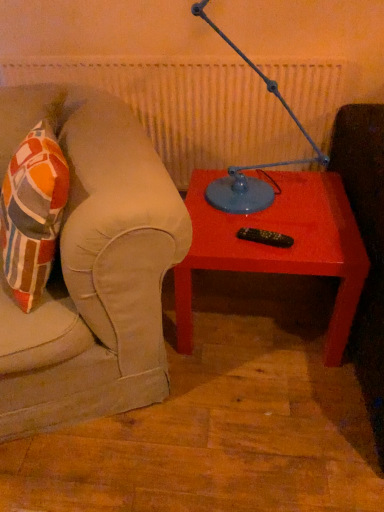
Describe the element at coordinates (253, 165) in the screenshot. I see `blue metallic table lamp at upper center` at that location.

Where is `blue metallic table lamp at upper center`? The height and width of the screenshot is (512, 384). blue metallic table lamp at upper center is located at coordinates (253, 165).

What is the approximate width of matte red table at center?

The width of matte red table at center is 25.57 inches.

Locate an element on the screen. The height and width of the screenshot is (512, 384). matte red table at center is located at coordinates (279, 248).

Image resolution: width=384 pixels, height=512 pixels. What do you see at coordinates (279, 248) in the screenshot? I see `matte red table at center` at bounding box center [279, 248].

This screenshot has width=384, height=512. I want to click on blue metallic table lamp at upper center, so click(253, 165).

Considering the relative positions of matte red table at center and blue metallic table lamp at upper center in the image provided, is matte red table at center to the left of blue metallic table lamp at upper center from the viewer's perspective?

No, matte red table at center is not to the left of blue metallic table lamp at upper center.

Between matte red table at center and blue metallic table lamp at upper center, which one is positioned behind?

Positioned behind is matte red table at center.

Is point (348, 211) more distant than point (211, 183)?

That is False.

From the image's perspective, who appears lower, matte red table at center or blue metallic table lamp at upper center?

matte red table at center.

From a real-world perspective, which object stands above the other?

blue metallic table lamp at upper center is physically above.

Can you confirm if matte red table at center is thinner than blue metallic table lamp at upper center?

No.

In the scene shown: Can you confirm if matte red table at center is shorter than blue metallic table lamp at upper center?

Correct, matte red table at center is not as tall as blue metallic table lamp at upper center.

Considering the sizes of matte red table at center and blue metallic table lamp at upper center in the image, is matte red table at center bigger or smaller than blue metallic table lamp at upper center?

In the image, matte red table at center appears to be larger than blue metallic table lamp at upper center.

Based on the photo, is matte red table at center positioned beyond the bounds of blue metallic table lamp at upper center?

Yes.

Would you consider matte red table at center to be distant from blue metallic table lamp at upper center?

That's not correct — matte red table at center is a little close to blue metallic table lamp at upper center.

Is matte red table at center oriented towards blue metallic table lamp at upper center?

No, matte red table at center is not aimed at blue metallic table lamp at upper center.

This screenshot has width=384, height=512. I want to click on table lying on the right of blue metallic table lamp at upper center, so click(279, 248).

Does blue metallic table lamp at upper center appear on the right side of matte red table at center?

No.

From the picture: Considering the positions of objects blue metallic table lamp at upper center and matte red table at center in the image provided, who is behind, blue metallic table lamp at upper center or matte red table at center?

matte red table at center is more distant.

Which is nearer, (286, 165) or (337, 328)?

Point (286, 165) appears to be farther away from the viewer than point (337, 328).

From the image's perspective, which is below, blue metallic table lamp at upper center or matte red table at center?

matte red table at center, from the image's perspective.

From a real-world perspective, is blue metallic table lamp at upper center on top of matte red table at center?

Yes, from a real-world perspective, blue metallic table lamp at upper center is over matte red table at center

Between blue metallic table lamp at upper center and matte red table at center, which one has larger width?

matte red table at center is wider.

Can you confirm if blue metallic table lamp at upper center is shorter than matte red table at center?

Incorrect, the height of blue metallic table lamp at upper center does not fall short of that of matte red table at center.

Does blue metallic table lamp at upper center have a larger size compared to matte red table at center?

No.

Would you say blue metallic table lamp at upper center is inside or outside matte red table at center?

blue metallic table lamp at upper center is outside matte red table at center.

Looking at this image, are blue metallic table lamp at upper center and matte red table at center located far from each other?

They are positioned close to each other.

Is blue metallic table lamp at upper center facing away from matte red table at center?

No, blue metallic table lamp at upper center is not facing the opposite direction of matte red table at center.

How distant is blue metallic table lamp at upper center from matte red table at center?

blue metallic table lamp at upper center and matte red table at center are 8.00 inches apart.

Where is `table below the blue metallic table lamp at upper center (from the image's perspective)`? This screenshot has width=384, height=512. table below the blue metallic table lamp at upper center (from the image's perspective) is located at coordinates point(279,248).

This screenshot has height=512, width=384. Identify the location of table lamp on the left of matte red table at center. (253, 165).

Find the location of a particular element. Image resolution: width=384 pixels, height=512 pixels. table lamp above the matte red table at center (from a real-world perspective) is located at coordinates (253, 165).